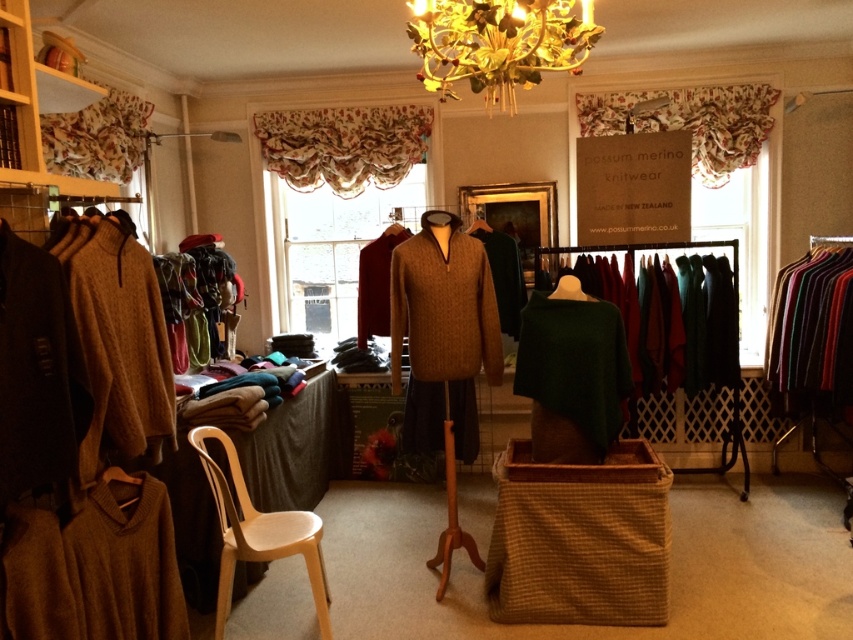
Is gold leaf chandelier at upper center positioned at the back of knitted wool sweater at right?

No, gold leaf chandelier at upper center is in front of knitted wool sweater at right.

Can you confirm if gold leaf chandelier at upper center is positioned to the left of knitted wool sweater at right?

Indeed, gold leaf chandelier at upper center is positioned on the left side of knitted wool sweater at right.

Image resolution: width=853 pixels, height=640 pixels. Find the location of `gold leaf chandelier at upper center`. gold leaf chandelier at upper center is located at coordinates (497, 44).

Can you confirm if knitted brown sweater at center is positioned above green wool sweater at center?

Actually, knitted brown sweater at center is below green wool sweater at center.

Measure the distance between point (497,368) and camera.

Point (497,368) is 3.12 meters away from camera.

Who is more distant from viewer, (426, 419) or (572, 252)?

Positioned behind is point (426, 419).

Where is `knitted brown sweater at center`? The width and height of the screenshot is (853, 640). knitted brown sweater at center is located at coordinates (442, 332).

Between maroon wool sweater at center and green wool sweater at center, which one is positioned higher?

Positioned higher is green wool sweater at center.

This screenshot has height=640, width=853. I want to click on maroon wool sweater at center, so click(x=376, y=284).

Describe the element at coordinates (376, 284) in the screenshot. I see `maroon wool sweater at center` at that location.

The image size is (853, 640). I want to click on maroon wool sweater at center, so click(x=376, y=284).